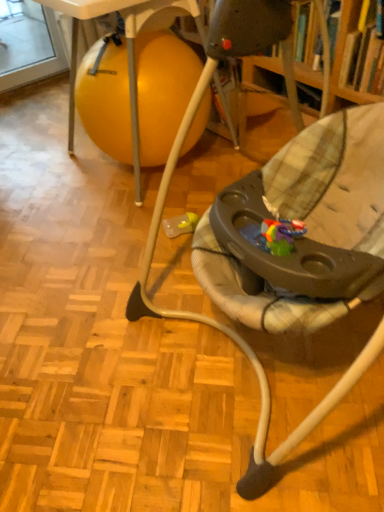
What is the approximate height of black plastic walker at center?

It is 38.08 inches.

Where is `black plastic walker at center`? This screenshot has height=512, width=384. black plastic walker at center is located at coordinates (160, 221).

What do you see at coordinates (160, 221) in the screenshot? This screenshot has width=384, height=512. I see `black plastic walker at center` at bounding box center [160, 221].

Where is `white plastic table at upper left`? This screenshot has height=512, width=384. white plastic table at upper left is located at coordinates (127, 53).

The image size is (384, 512). What do you see at coordinates (127, 53) in the screenshot?
I see `white plastic table at upper left` at bounding box center [127, 53].

You are a GUI agent. You are given a task and a screenshot of the screen. Output one action in this format:
    pyautogui.click(x=<x>, y=<y>)
    Task: Click on the black plastic walker at center
    
    Given the screenshot: What is the action you would take?
    pyautogui.click(x=160, y=221)

Is white plastic table at upper left to the left or to the right of black plastic walker at center in the image?

Based on their positions, white plastic table at upper left is located to the left of black plastic walker at center.

Between white plastic table at upper left and black plastic walker at center, which one is positioned in front?

black plastic walker at center.

Considering the points (130, 11) and (264, 462), which point is in front, point (130, 11) or point (264, 462)?

The point (264, 462) is in front.

From the image's perspective, which one is positioned higher, white plastic table at upper left or black plastic walker at center?

white plastic table at upper left appears higher in the image.

From a real-world perspective, which object rests below the other?

white plastic table at upper left, from a real-world perspective.

Considering the sizes of objects white plastic table at upper left and black plastic walker at center in the image provided, who is wider, white plastic table at upper left or black plastic walker at center?

black plastic walker at center.

In terms of height, does white plastic table at upper left look taller or shorter compared to black plastic walker at center?

Clearly, white plastic table at upper left is shorter compared to black plastic walker at center.

Does white plastic table at upper left have a larger size compared to black plastic walker at center?

No, white plastic table at upper left is not bigger than black plastic walker at center.

Do you think white plastic table at upper left is within black plastic walker at center, or outside of it?

white plastic table at upper left cannot be found inside black plastic walker at center.

In the scene shown: Is white plastic table at upper left far away from black plastic walker at center?

white plastic table at upper left is near black plastic walker at center, not far away.

Is white plastic table at upper left looking in the opposite direction of black plastic walker at center?

No, white plastic table at upper left is not facing the opposite direction of black plastic walker at center.

How different are the orientations of white plastic table at upper left and black plastic walker at center in degrees?

white plastic table at upper left and black plastic walker at center are facing 98.4 degrees away from each other.

Locate an element on the screen. table lying on the left of black plastic walker at center is located at coordinates (127, 53).

Is black plastic walker at center at the right side of white plastic table at upper left?

Indeed, black plastic walker at center is positioned on the right side of white plastic table at upper left.

Is black plastic walker at center closer to the viewer compared to white plastic table at upper left?

Yes, it is.

Is point (135, 311) behind point (138, 189)?

No, (135, 311) is in front of (138, 189).

From the image's perspective, would you say black plastic walker at center is shown under white plastic table at upper left?

Yes, from the image's perspective, black plastic walker at center is beneath white plastic table at upper left.

From a real-world perspective, is black plastic walker at center below white plastic table at upper left?

Incorrect, from a real-world perspective, black plastic walker at center is higher than white plastic table at upper left.

Which of these two, black plastic walker at center or white plastic table at upper left, is thinner?

white plastic table at upper left is thinner.

In the scene shown: Who is taller, black plastic walker at center or white plastic table at upper left?

Standing taller between the two is black plastic walker at center.

Is black plastic walker at center bigger or smaller than white plastic table at upper left?

Considering their sizes, black plastic walker at center takes up more space than white plastic table at upper left.

Is white plastic table at upper left inside black plastic walker at center?

No.

Based on the photo, is black plastic walker at center positioned far away from white plastic table at upper left?

No, there isn't a large distance between black plastic walker at center and white plastic table at upper left.

Could you tell me if black plastic walker at center is turned towards white plastic table at upper left?

No.

Measure the distance from black plastic walker at center to white plastic table at upper left.

A distance of 27.58 inches exists between black plastic walker at center and white plastic table at upper left.

This screenshot has width=384, height=512. Identify the location of chair that is in front of the white plastic table at upper left. (160, 221).

Image resolution: width=384 pixels, height=512 pixels. I want to click on chair on the right side of white plastic table at upper left, so click(160, 221).

In order to click on table behind the black plastic walker at center in this screenshot , I will do `click(127, 53)`.